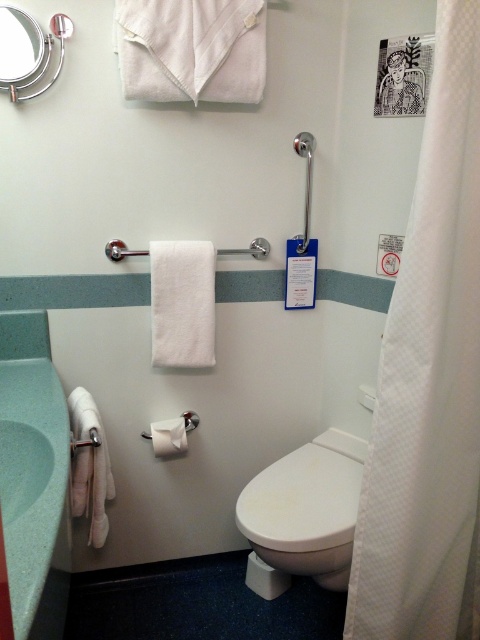
Question: Which of the following is the farthest from the observer?

Choices:
 (A) white textured shower curtain at right
 (B) satin silver grab bar at upper center

Answer: (B)

Question: Is white cotton bath towel at upper center to the right of white soft towel at left from the viewer's perspective?

Choices:
 (A) yes
 (B) no

Answer: (A)

Question: Which of these objects is positioned farthest from the white matte toilet paper at lower center?

Choices:
 (A) white cotton bath towel at upper center
 (B) white glossy toilet at center

Answer: (A)

Question: Is white cotton bath towel at upper center positioned behind white matte toilet paper at lower center?

Choices:
 (A) yes
 (B) no

Answer: (B)

Question: Can you confirm if white soft towel at left is smaller than green matte sink at lower left?

Choices:
 (A) yes
 (B) no

Answer: (B)

Question: Which object is the closest to the white textured shower curtain at right?

Choices:
 (A) white glossy toilet at center
 (B) white soft towel at left
 (C) white soft towel at center
 (D) white matte toilet paper at lower center

Answer: (A)